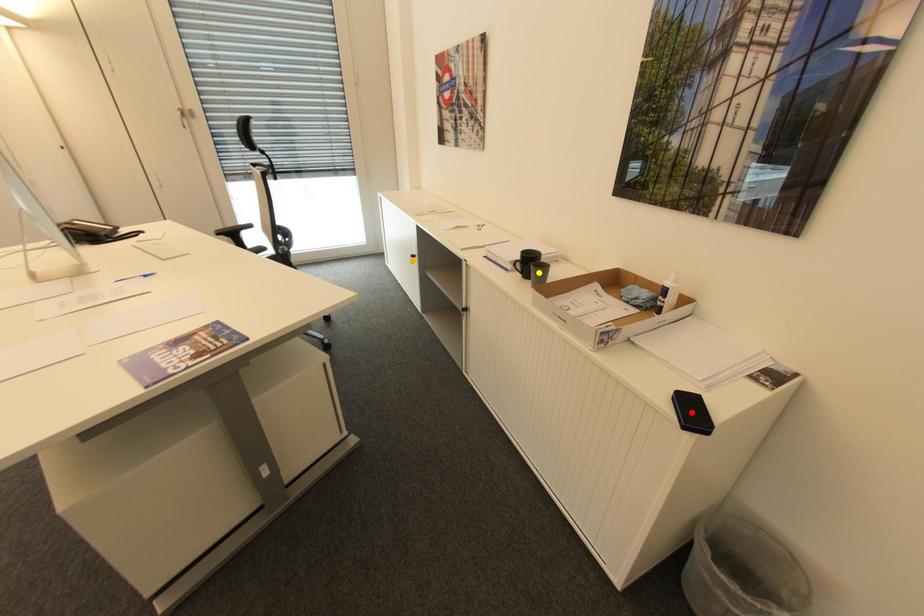
Order these from nearest to farthest:
- red point
- orange point
- yellow point

red point
yellow point
orange point